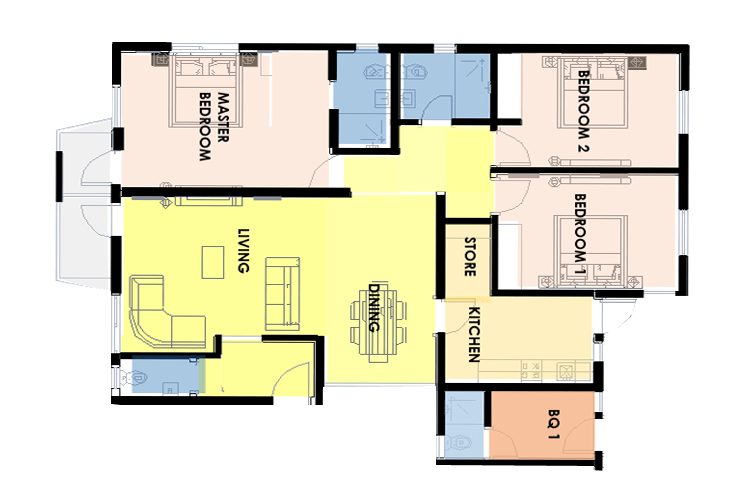
This screenshot has height=500, width=750. I want to click on chairs, so click(x=356, y=308), click(x=351, y=339), click(x=379, y=361), click(x=381, y=283), click(x=403, y=307), click(x=400, y=333).